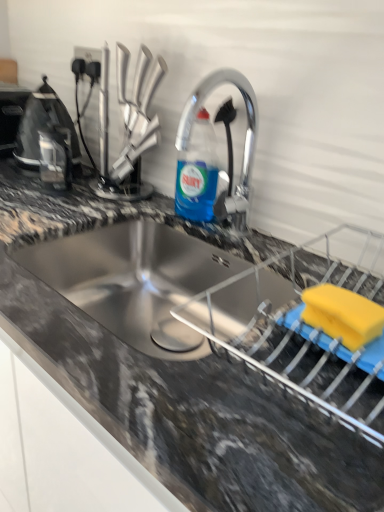
Question: Is the depth of granite gray countertop at center greater than that of black plastic toaster at left, the first appliance viewed from the left?

Choices:
 (A) yes
 (B) no

Answer: (B)

Question: Can you confirm if granite gray countertop at center is positioned to the left of black plastic toaster at left, arranged as the third appliance when viewed from the right?

Choices:
 (A) yes
 (B) no

Answer: (B)

Question: Is granite gray countertop at center not inside black plastic toaster at left, placed as the 1th appliance when sorted from top to bottom?

Choices:
 (A) no
 (B) yes

Answer: (B)

Question: Does granite gray countertop at center lie in front of black plastic toaster at left, positioned as the first appliance in back-to-front order?

Choices:
 (A) no
 (B) yes

Answer: (B)

Question: Can you confirm if granite gray countertop at center is wider than black plastic toaster at left, acting as the third appliance starting from the bottom?

Choices:
 (A) yes
 (B) no

Answer: (A)

Question: Is granite gray countertop at center bigger than black plastic toaster at left, placed as the 1th appliance when sorted from top to bottom?

Choices:
 (A) no
 (B) yes

Answer: (B)

Question: Can you confirm if yellow sponge at lower right, positioned as the 1th appliance in bottom-to-top order, is taller than granite gray countertop at center?

Choices:
 (A) yes
 (B) no

Answer: (B)

Question: Considering the relative positions of yellow sponge at lower right, the first appliance positioned from the front, and granite gray countertop at center in the image provided, is yellow sponge at lower right, the first appliance positioned from the front, to the right of granite gray countertop at center from the viewer's perspective?

Choices:
 (A) no
 (B) yes

Answer: (B)

Question: Is yellow sponge at lower right, the first appliance positioned from the front, next to granite gray countertop at center and touching it?

Choices:
 (A) yes
 (B) no

Answer: (B)

Question: Does yellow sponge at lower right, acting as the first appliance starting from the right, have a larger size compared to granite gray countertop at center?

Choices:
 (A) yes
 (B) no

Answer: (B)

Question: Could you tell me if yellow sponge at lower right, acting as the first appliance starting from the right, is facing granite gray countertop at center?

Choices:
 (A) no
 (B) yes

Answer: (A)

Question: From the image's perspective, is yellow sponge at lower right, acting as the first appliance starting from the right, located beneath granite gray countertop at center?

Choices:
 (A) yes
 (B) no

Answer: (B)

Question: Is black plastic kettle at left, acting as the second appliance starting from the front, completely or partially inside blue translucent liquid at center?

Choices:
 (A) no
 (B) yes

Answer: (A)